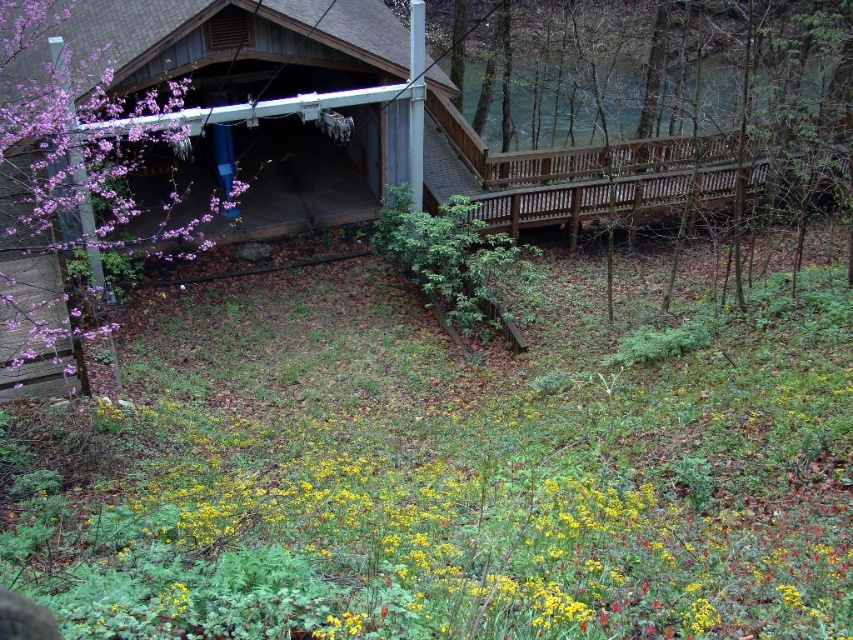
Question: Considering the real-world distances, which object is farthest from the brown wooden bridge at right?

Choices:
 (A) wooden cabin at upper left
 (B) pink blossoms at left

Answer: (B)

Question: Is brown wooden bridge at right to the right of pink blossoms at left from the viewer's perspective?

Choices:
 (A) yes
 (B) no

Answer: (A)

Question: Which of the following is the farthest from the observer?

Choices:
 (A) (141, 104)
 (B) (115, 225)
 (C) (802, 13)

Answer: (B)

Question: Considering the relative positions of brown wooden bridge at right and brown wooden porch at right in the image provided, where is brown wooden bridge at right located with respect to brown wooden porch at right?

Choices:
 (A) below
 (B) above

Answer: (B)

Question: Does brown wooden bridge at right have a lesser width compared to brown wooden porch at right?

Choices:
 (A) no
 (B) yes

Answer: (A)

Question: Among these points, which one is nearest to the camera?

Choices:
 (A) (579, 216)
 (B) (680, 49)

Answer: (A)